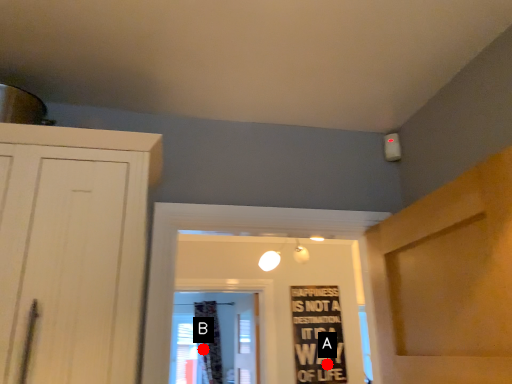
Question: Two points are circled on the image, labeled by A and B beside each circle. Which point appears closest to the camera in this image?

Choices:
 (A) A is closer
 (B) B is closer

Answer: (A)